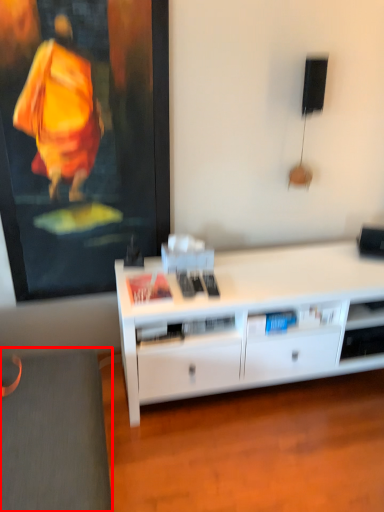
Question: From the image's perspective, where is gray (annotated by the red box) located relative to desk?

Choices:
 (A) above
 (B) below

Answer: (B)